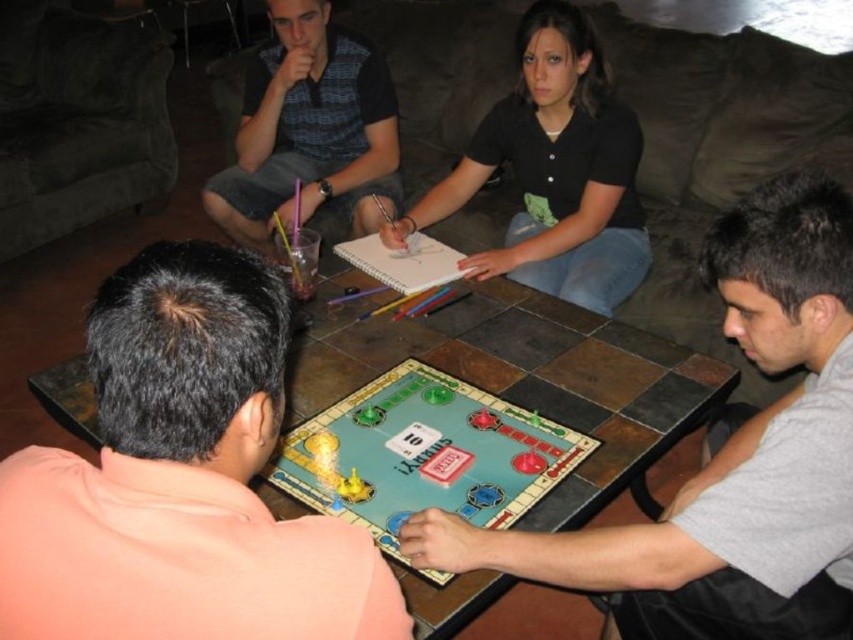
You are a photographer aiming to capture a closeup of the gray fabric shirt at center without including the camera in the frame. Given that the camera is 33.48 inches away from the shirt, what is the minimum distance you need to move the camera backward to ensure the shirt fills the frame while excluding the camera itself?

The camera is 33.48 inches away from the gray fabric shirt at center. To exclude the camera from the frame while focusing on the shirt, you need to move the camera back by at least 33.48 inches. This distance ensures the shirt remains in focus while the camera itself is no longer within the shot.

You are a delivery person who needs to place a large package on the brown fabric couch at upper center. The package is 1.9 meters long. Can you place it horizontally on the couch without exceeding its length? Explain your reasoning.

The distance between the brown fabric couch at upper center and the viewer is 1.88 meters. Since the package is 1.9 meters long, which is slightly longer than the distance available, it cannot be placed horizontally on the couch without exceeding its length.

You are a small toy car that is 10 cm tall. You want to move from the floor to the light blue plastic board game at center. Can you drive over the brown fabric couch at upper center to reach it?

The brown fabric couch at upper center is much taller than the light blue plastic board game at center. Since the toy car is only 10 cm tall, it cannot drive over the brown fabric couch at upper center because it is too tall.